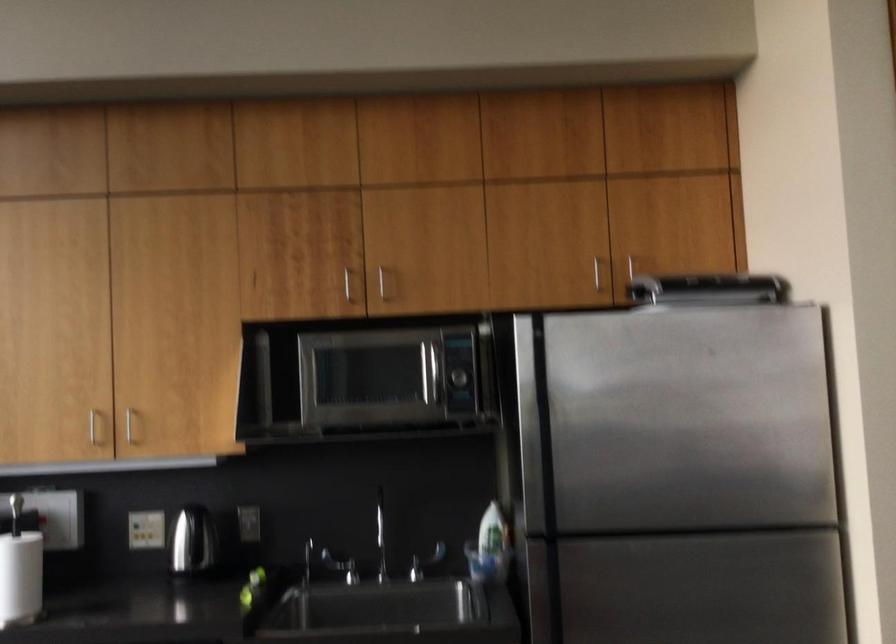
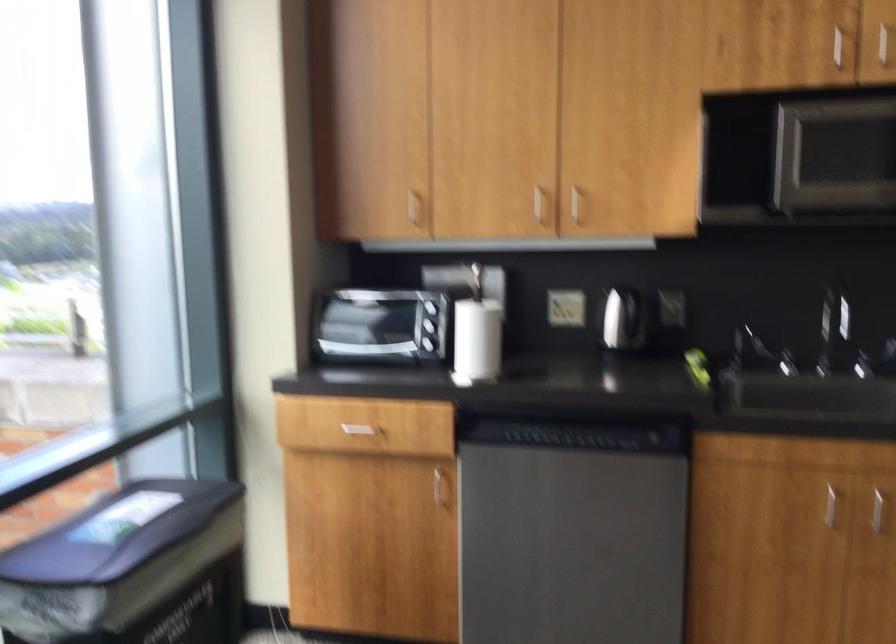
Question: The images are taken continuously from a first-person perspective. In which direction are you moving?

Choices:
 (A) Left
 (B) Right
 (C) Forward
 (D) Backward

Answer: (A)